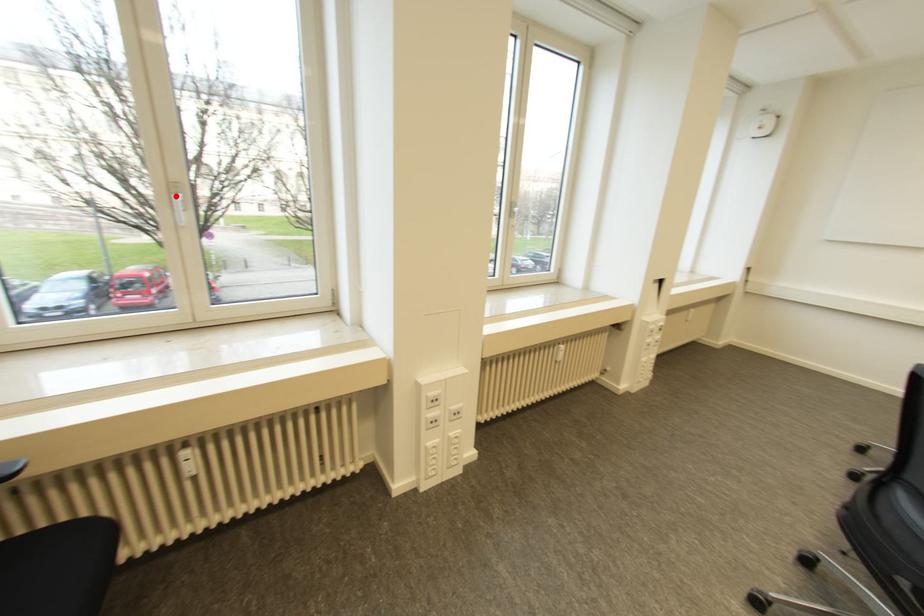
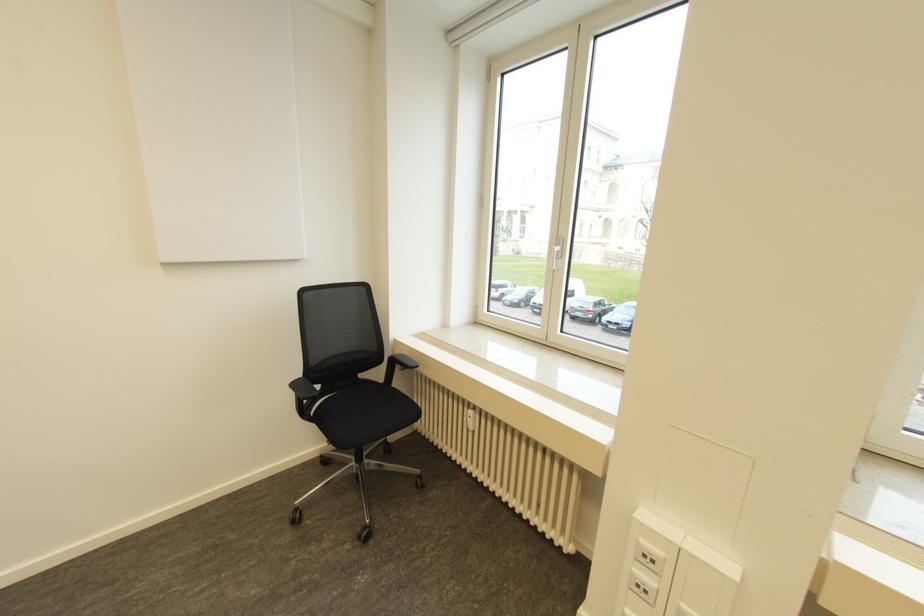
The point at the highlighted location is marked in the first image. Where is the corresponding point in the second image?

(557, 248)